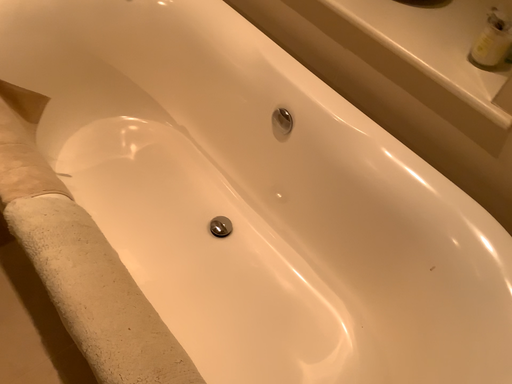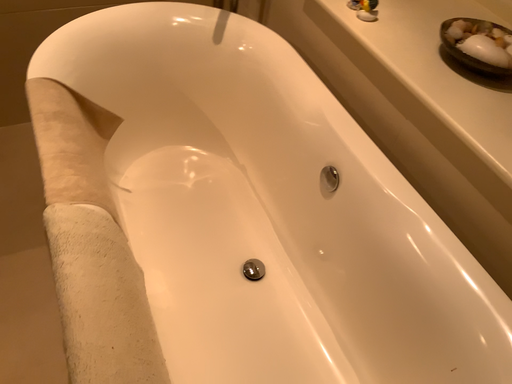
Question: Which way did the camera rotate in the video?

Choices:
 (A) rotated right
 (B) rotated left

Answer: (B)